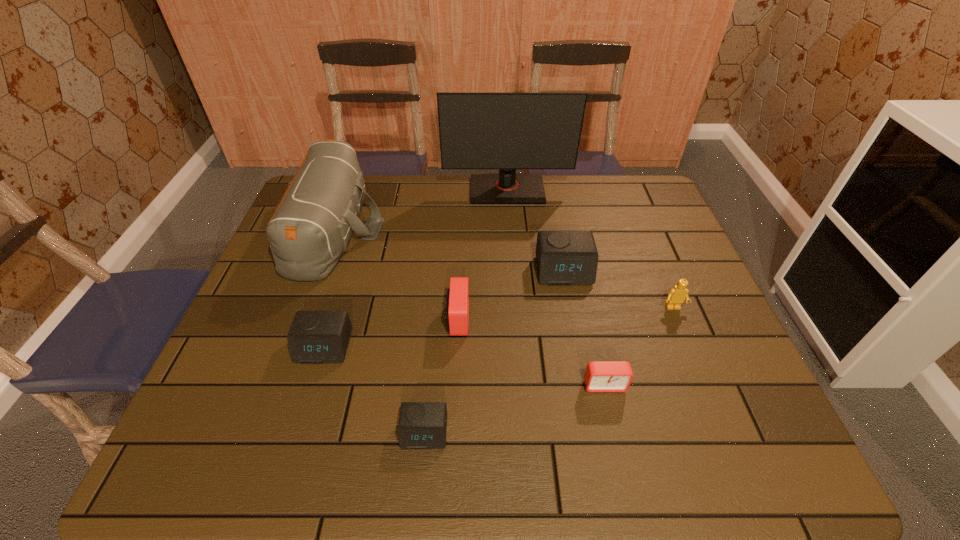
Where is `blank area located 0.170m on the front-facing side of the nearer red alarm clock`? blank area located 0.170m on the front-facing side of the nearer red alarm clock is located at coordinates (624, 474).

You are a GUI agent. You are given a task and a screenshot of the screen. Output one action in this format:
    pyautogui.click(x=<x>, y=<y>)
    Task: Click on the monitor positioned at the far edge
    
    Given the screenshot: What is the action you would take?
    pyautogui.click(x=507, y=131)

The height and width of the screenshot is (540, 960). Find the location of `duffel bag present at the far edge`. duffel bag present at the far edge is located at coordinates (312, 225).

Identify the location of object at the near edge. This screenshot has width=960, height=540. pos(422,425).

You are a GUI agent. You are given a task and a screenshot of the screen. Output one action in this format:
    pyautogui.click(x=<x>, y=<y>)
    Task: Click on the object present at the left edge
    The width and height of the screenshot is (960, 540).
    Given the screenshot: What is the action you would take?
    pyautogui.click(x=312, y=225)

Identify the location of object that is at the right edge. (676, 296).

Identify the location of object located in the far left corner section of the desktop. This screenshot has height=540, width=960. (312, 225).

This screenshot has width=960, height=540. What are the coordinates of `vacant space at the far edge of the desktop` in the screenshot? It's located at (597, 206).

Where is `blank space at the near edge of the desktop`? This screenshot has height=540, width=960. blank space at the near edge of the desktop is located at coordinates (499, 442).

This screenshot has height=540, width=960. What are the coordinates of `blank space at the left edge of the desktop` in the screenshot? It's located at (280, 352).